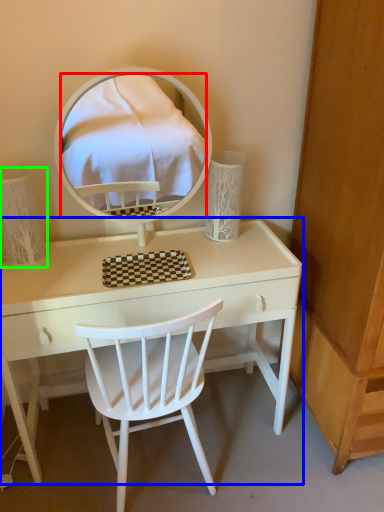
Question: Based on their relative distances, which object is farther from mirror (highlighted by a red box)? Choose from table (highlighted by a blue box) and table lamp (highlighted by a green box).

Choices:
 (A) table
 (B) table lamp

Answer: (B)